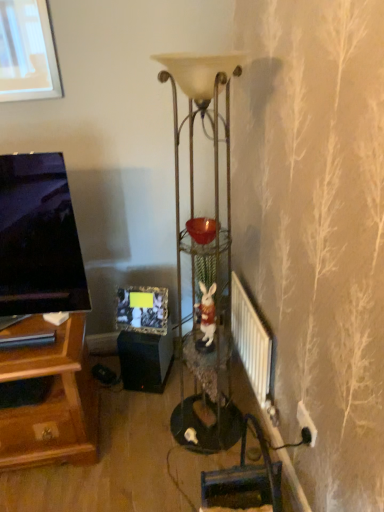
The image size is (384, 512). Find the location of `vacant space that's between black matte speaker at lower center and metallic gold floor lamp at center`. vacant space that's between black matte speaker at lower center and metallic gold floor lamp at center is located at coordinates (162, 397).